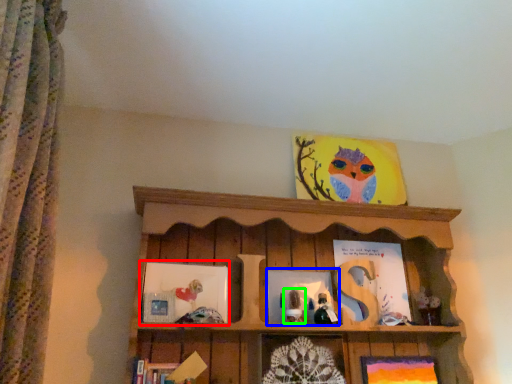
Question: Based on their relative distances, which object is farther from picture frame (highlighted by a red box)? Choose from picture frame (highlighted by a blue box) and toy (highlighted by a green box).

Choices:
 (A) picture frame
 (B) toy

Answer: (B)